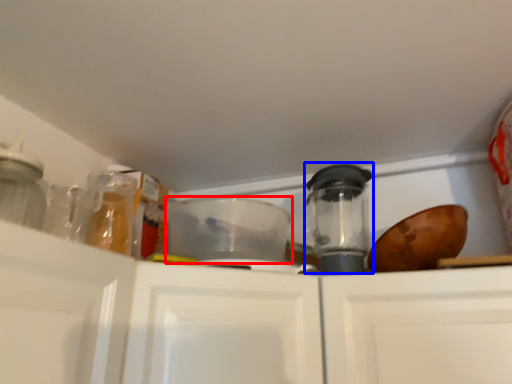
Question: Which object is further to the camera taking this photo, appliance (highlighted by a red box) or appliance (highlighted by a blue box)?

Choices:
 (A) appliance
 (B) appliance

Answer: (B)